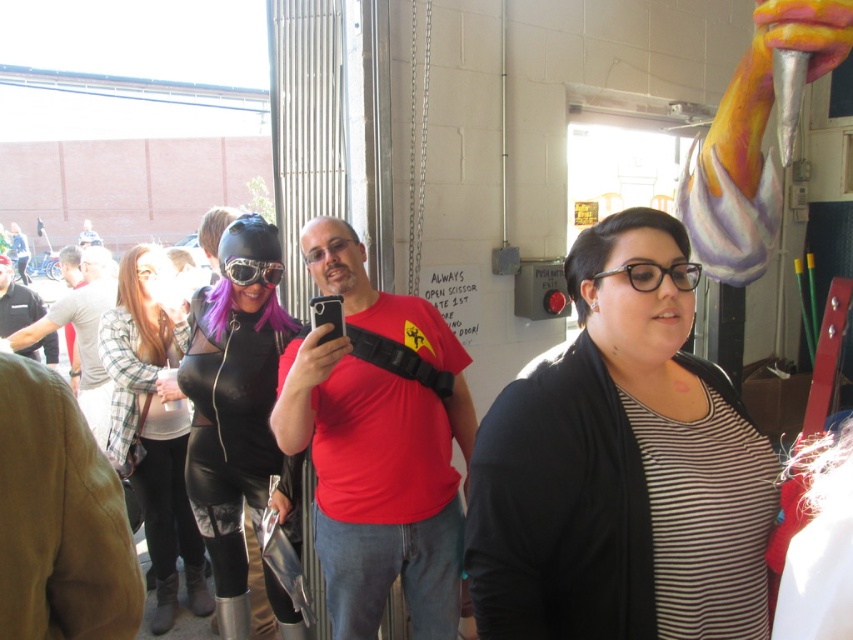
You are organizing a photoshoot in the garage and need to ensure that the black leather bodysuit at center and the matte black shirt at center are both visible in the frame. Given their sizes, which one might require more careful positioning to avoid being overshadowed?

The black leather bodysuit at center occupies less space than the matte black shirt at center, so it might require more careful positioning to avoid being overshadowed by the larger matte black shirt at center.

You are organizing a cosplay event and need to ensure that the participants have enough space to move around. You notice the matte black shirt at center and the matte black goggles at center. Which object takes up more horizontal space?

The matte black shirt at center has a larger width than the matte black goggles at center, so the shirt takes up more horizontal space.